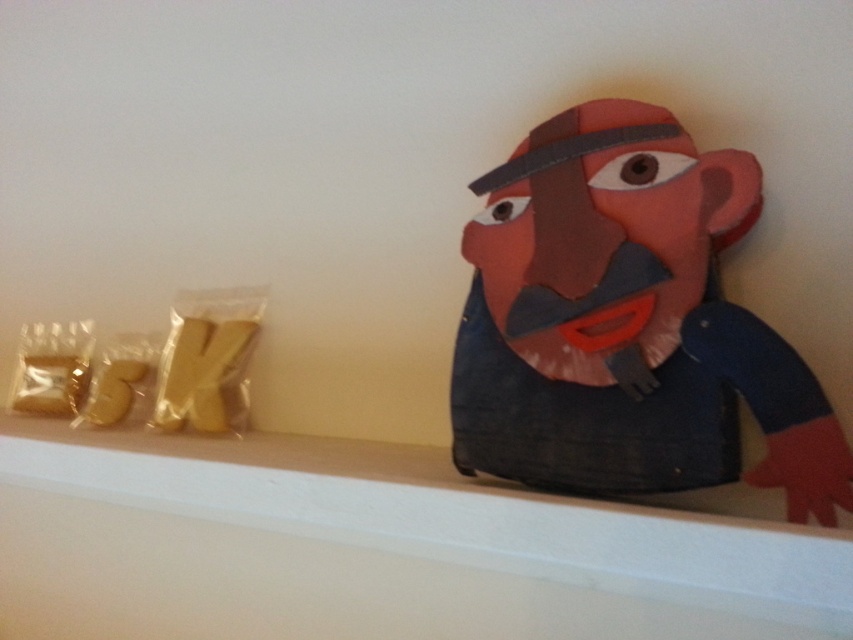
Question: In this image, where is denim-like paper mask at upper right located relative to white smooth ledge at upper center?

Choices:
 (A) left
 (B) right

Answer: (B)

Question: Which of the following is the farthest from the observer?

Choices:
 (A) (404, 579)
 (B) (567, 252)

Answer: (A)

Question: Can you confirm if denim-like paper mask at upper right is positioned to the left of white smooth ledge at upper center?

Choices:
 (A) yes
 (B) no

Answer: (B)

Question: Which point is farther to the camera?

Choices:
 (A) pyautogui.click(x=589, y=273)
 (B) pyautogui.click(x=381, y=516)

Answer: (A)

Question: Is denim-like paper mask at upper right wider than white smooth ledge at upper center?

Choices:
 (A) yes
 (B) no

Answer: (B)